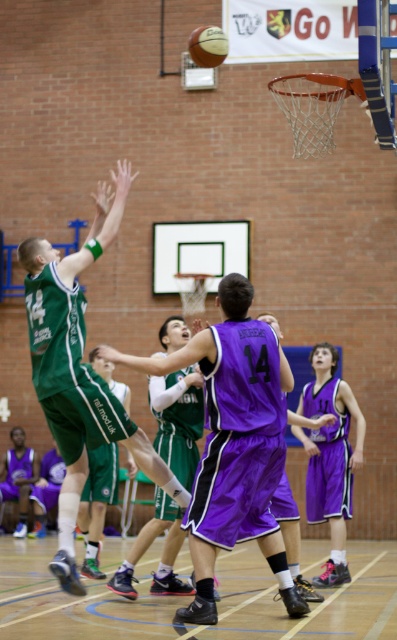
Question: Is purple shiny jersey at center positioned behind rubber textured basketball at upper center?

Choices:
 (A) no
 (B) yes

Answer: (A)

Question: Which point is farther from the camera taking this photo?

Choices:
 (A) (100, 189)
 (B) (223, 445)
 (C) (327, 515)
 (D) (115, 456)

Answer: (D)

Question: Which object is closer to the camera taking this photo?

Choices:
 (A) purple jersey at center
 (B) green jersey at left
 (C) purple shiny jersey at center
 (D) rubber textured basketball at upper center

Answer: (B)

Question: Does green jersey at left appear on the left side of purple jersey at lower left?

Choices:
 (A) yes
 (B) no

Answer: (B)

Question: Considering the relative positions of purple shiny jersey at center and green jersey at center in the image provided, where is purple shiny jersey at center located with respect to green jersey at center?

Choices:
 (A) below
 (B) above

Answer: (B)

Question: Among these objects, which one is nearest to the camera?

Choices:
 (A) green jersey at center
 (B) purple jersey at lower left

Answer: (A)